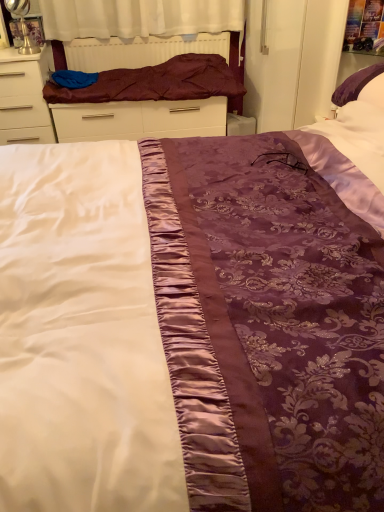
Question: Is white glossy chest of drawers at left completely or partially inside maroon satin blanket at upper left?

Choices:
 (A) yes
 (B) no

Answer: (B)

Question: Would you say maroon satin blanket at upper left is outside white glossy chest of drawers at left?

Choices:
 (A) yes
 (B) no

Answer: (A)

Question: Is maroon satin blanket at upper left positioned in front of white glossy chest of drawers at left?

Choices:
 (A) no
 (B) yes

Answer: (A)

Question: Is maroon satin blanket at upper left to the left of white glossy chest of drawers at left from the viewer's perspective?

Choices:
 (A) yes
 (B) no

Answer: (B)

Question: Is maroon satin blanket at upper left positioned with its back to white glossy chest of drawers at left?

Choices:
 (A) yes
 (B) no

Answer: (B)

Question: Is point (218, 130) closer or farther from the camera than point (228, 95)?

Choices:
 (A) farther
 (B) closer

Answer: (A)

Question: Considering the relative positions of maroon satin bed frame at upper center and maroon satin blanket at upper left in the image provided, is maroon satin bed frame at upper center to the left or to the right of maroon satin blanket at upper left?

Choices:
 (A) left
 (B) right

Answer: (B)

Question: Is maroon satin bed frame at upper center inside or outside of maroon satin blanket at upper left?

Choices:
 (A) inside
 (B) outside

Answer: (B)

Question: From a real-world perspective, is maroon satin bed frame at upper center above or below maroon satin blanket at upper left?

Choices:
 (A) above
 (B) below

Answer: (B)

Question: Based on their positions, is maroon satin bed frame at upper center located to the left or right of white glossy chest of drawers at left?

Choices:
 (A) right
 (B) left

Answer: (A)

Question: In terms of width, does maroon satin bed frame at upper center look wider or thinner when compared to white glossy chest of drawers at left?

Choices:
 (A) thin
 (B) wide

Answer: (A)

Question: Considering the positions of maroon satin bed frame at upper center and white glossy chest of drawers at left in the image, is maroon satin bed frame at upper center taller or shorter than white glossy chest of drawers at left?

Choices:
 (A) short
 (B) tall

Answer: (A)

Question: Does point (203, 59) appear closer or farther from the camera than point (36, 84)?

Choices:
 (A) farther
 (B) closer

Answer: (A)

Question: Looking at their shapes, would you say white glossy chest of drawers at left is wider or thinner than maroon satin blanket at upper left?

Choices:
 (A) thin
 (B) wide

Answer: (B)

Question: Considering the positions of point pyautogui.click(x=48, y=139) and point pyautogui.click(x=67, y=95), is point pyautogui.click(x=48, y=139) closer or farther from the camera than point pyautogui.click(x=67, y=95)?

Choices:
 (A) farther
 (B) closer

Answer: (A)